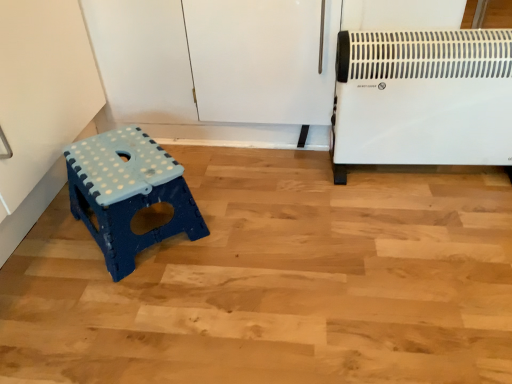
Question: Should I look upward or downward to see white plastic heater at right?

Choices:
 (A) up
 (B) down

Answer: (A)

Question: Should I look upward or downward to see blue plastic stool at lower left?

Choices:
 (A) down
 (B) up

Answer: (A)

Question: Does white plastic heater at right come in front of blue plastic stool at lower left?

Choices:
 (A) yes
 (B) no

Answer: (B)

Question: Is white plastic heater at right positioned beyond the bounds of blue plastic stool at lower left?

Choices:
 (A) yes
 (B) no

Answer: (A)

Question: Can you confirm if white plastic heater at right is thinner than blue plastic stool at lower left?

Choices:
 (A) no
 (B) yes

Answer: (B)

Question: Considering the relative sizes of white plastic heater at right and blue plastic stool at lower left in the image provided, is white plastic heater at right wider than blue plastic stool at lower left?

Choices:
 (A) yes
 (B) no

Answer: (B)

Question: Does white plastic heater at right appear on the left side of blue plastic stool at lower left?

Choices:
 (A) no
 (B) yes

Answer: (A)

Question: From the image's perspective, does white plastic heater at right appear higher than blue plastic stool at lower left?

Choices:
 (A) no
 (B) yes

Answer: (B)

Question: Is blue plastic stool at lower left outside of white plastic heater at right?

Choices:
 (A) yes
 (B) no

Answer: (A)

Question: Are blue plastic stool at lower left and white plastic heater at right beside each other?

Choices:
 (A) no
 (B) yes

Answer: (A)

Question: Does blue plastic stool at lower left come in front of white plastic heater at right?

Choices:
 (A) no
 (B) yes

Answer: (B)

Question: Does blue plastic stool at lower left have a larger size compared to white plastic heater at right?

Choices:
 (A) no
 (B) yes

Answer: (A)

Question: Is blue plastic stool at lower left turned away from white plastic heater at right?

Choices:
 (A) no
 (B) yes

Answer: (A)

Question: Is blue plastic stool at lower left wider than white plastic heater at right?

Choices:
 (A) yes
 (B) no

Answer: (A)

Question: In terms of height, does white plastic heater at right look taller or shorter compared to blue plastic stool at lower left?

Choices:
 (A) short
 (B) tall

Answer: (B)